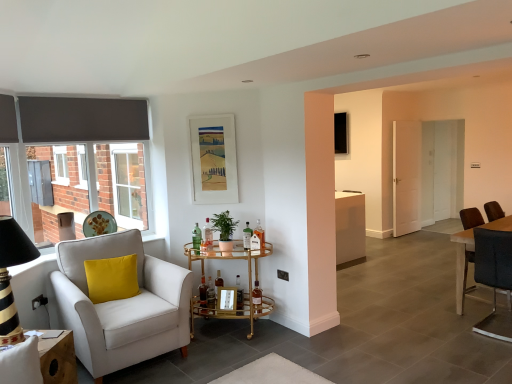
Question: In which direction should I rotate to look at translucent glass bottle at center, the 6th bottle from the right?

Choices:
 (A) left
 (B) right

Answer: (A)

Question: Can you confirm if green glass bottle at center, the 9th bottle when ordered from right to left, is bigger than gold mirrored bar cart at center?

Choices:
 (A) yes
 (B) no

Answer: (B)

Question: From the image's perspective, does green glass bottle at center, the 9th bottle when ordered from right to left, appear higher than gold mirrored bar cart at center?

Choices:
 (A) yes
 (B) no

Answer: (A)

Question: From the image's perspective, is green glass bottle at center, the first bottle when ordered from left to right, located beneath gold mirrored bar cart at center?

Choices:
 (A) no
 (B) yes

Answer: (A)

Question: Is green glass bottle at center, the 9th bottle when ordered from right to left, wider than gold mirrored bar cart at center?

Choices:
 (A) no
 (B) yes

Answer: (A)

Question: Is green glass bottle at center, the 9th bottle when ordered from right to left, taller than gold mirrored bar cart at center?

Choices:
 (A) yes
 (B) no

Answer: (B)

Question: Is green glass bottle at center, the first bottle when ordered from left to right, at the left side of gold mirrored bar cart at center?

Choices:
 (A) yes
 (B) no

Answer: (A)

Question: Is translucent glass bottle at center, which appears as the fifth bottle when viewed from the left, behind matte paper picture frame at upper center, the 2th picture frame in the top-to-bottom sequence?

Choices:
 (A) yes
 (B) no

Answer: (A)

Question: Is matte paper picture frame at upper center, the 1th picture frame viewed from the front, at the back of translucent glass bottle at center, which appears as the fifth bottle when viewed from the left?

Choices:
 (A) yes
 (B) no

Answer: (B)

Question: From a real-world perspective, is translucent glass bottle at center, which appears as the fifth bottle when viewed from the left, located higher than matte paper picture frame at upper center, the 2th picture frame in the top-to-bottom sequence?

Choices:
 (A) yes
 (B) no

Answer: (B)

Question: Considering the relative sizes of translucent glass bottle at center, the fifth bottle positioned from the right, and matte paper picture frame at upper center, the second picture frame when ordered from right to left, in the image provided, is translucent glass bottle at center, the fifth bottle positioned from the right, thinner than matte paper picture frame at upper center, the second picture frame when ordered from right to left,?

Choices:
 (A) no
 (B) yes

Answer: (A)

Question: Does translucent glass bottle at center, which appears as the fifth bottle when viewed from the left, have a larger size compared to matte paper picture frame at upper center, the 1th picture frame in the left-to-right sequence?

Choices:
 (A) yes
 (B) no

Answer: (B)

Question: Would you say translucent glass bottle at center, which appears as the fifth bottle when viewed from the left, is outside matte paper picture frame at upper center, the 1th picture frame in the left-to-right sequence?

Choices:
 (A) yes
 (B) no

Answer: (A)

Question: Is translucent glass bottle at center, the third bottle viewed from the right, to the right of translucent glass bottle at center, the 8th bottle when ordered from right to left, from the viewer's perspective?

Choices:
 (A) yes
 (B) no

Answer: (A)